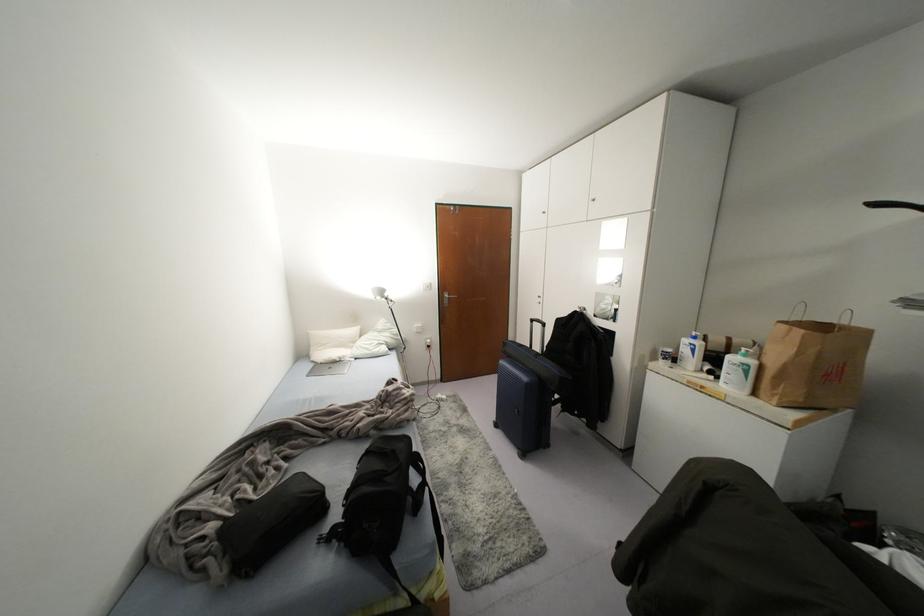
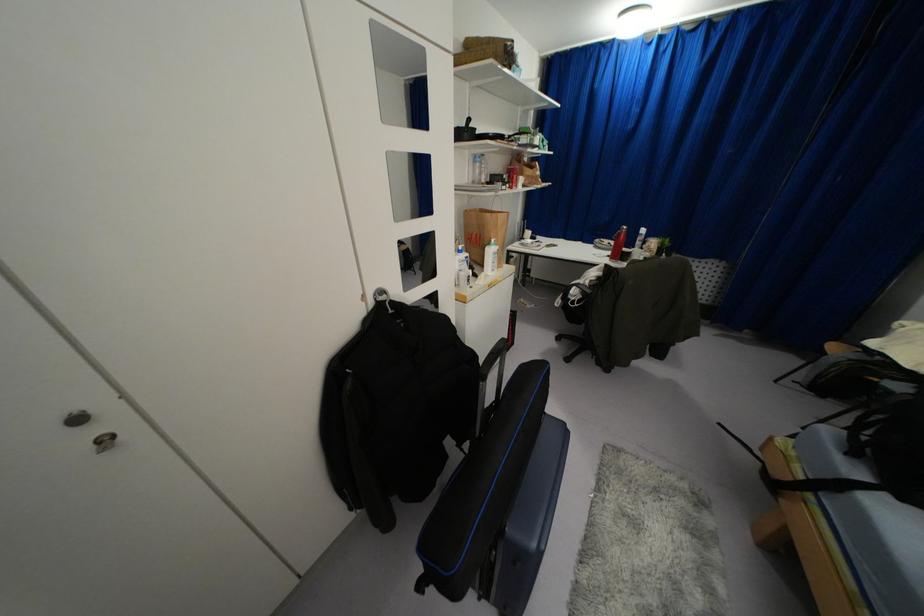
Where in the second image is the point corresponding to (x=751, y=362) from the first image?

(495, 246)